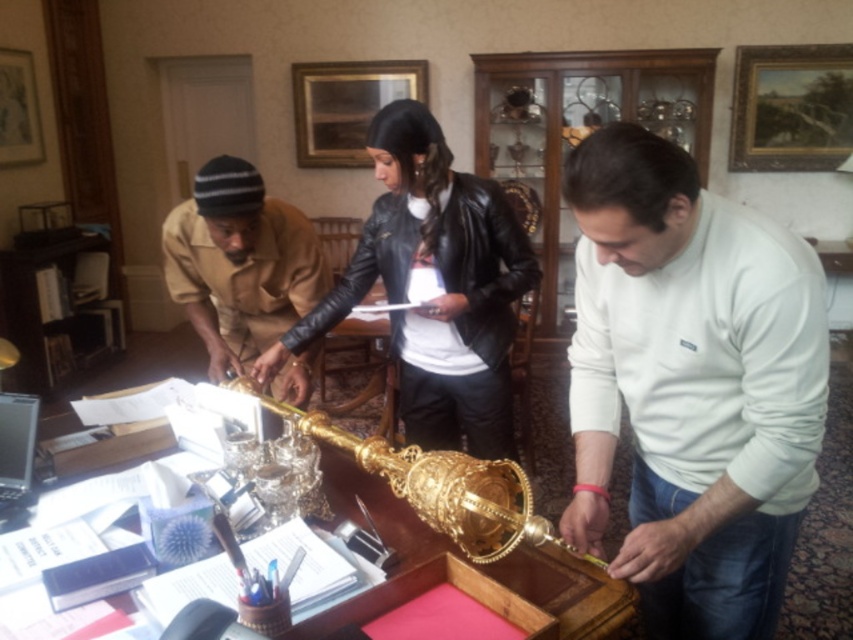
You are an interior designer planning to hang a coat rack in this office. You see the black leather jacket at center and the gold polished table at center. Which object is taller so you can decide where to place the rack?

The black leather jacket at center is taller than the gold polished table at center, so you should place the coat rack where it can accommodate the taller black leather jacket at center.

You are an interior designer planning to place a new lamp on the desk. The lamp requires a surface that is taller than the white cotton shirt at center. Can the gold polished table at center provide a suitable surface for the lamp?

The white cotton shirt at center is taller than the gold polished table at center. Since the lamp requires a surface taller than the white cotton shirt at center, the gold polished table at center cannot provide a suitable surface for the lamp.

Where is the black leather jacket at center located in the image?

The black leather jacket at center is located at point 0.450 on the x axis and 0.509 on the y axis.